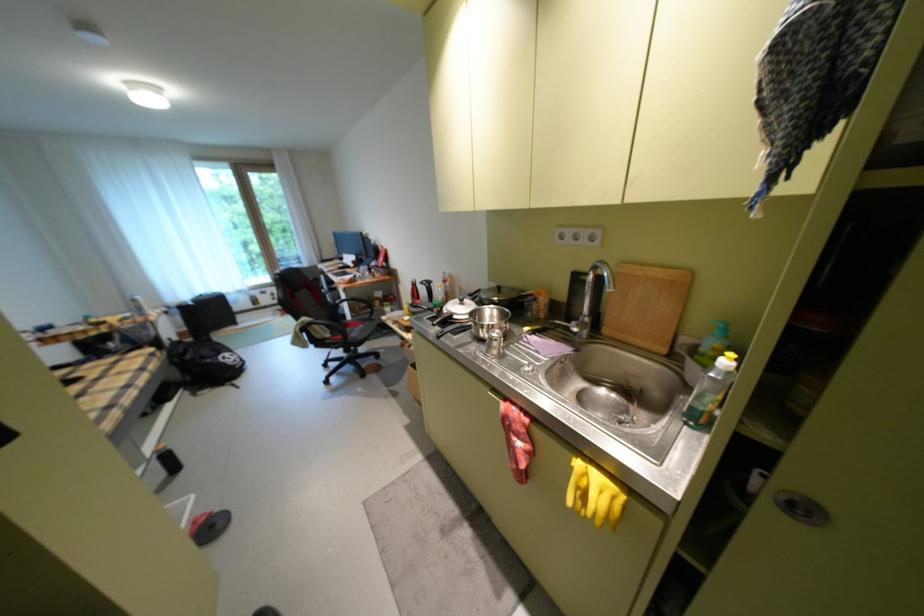
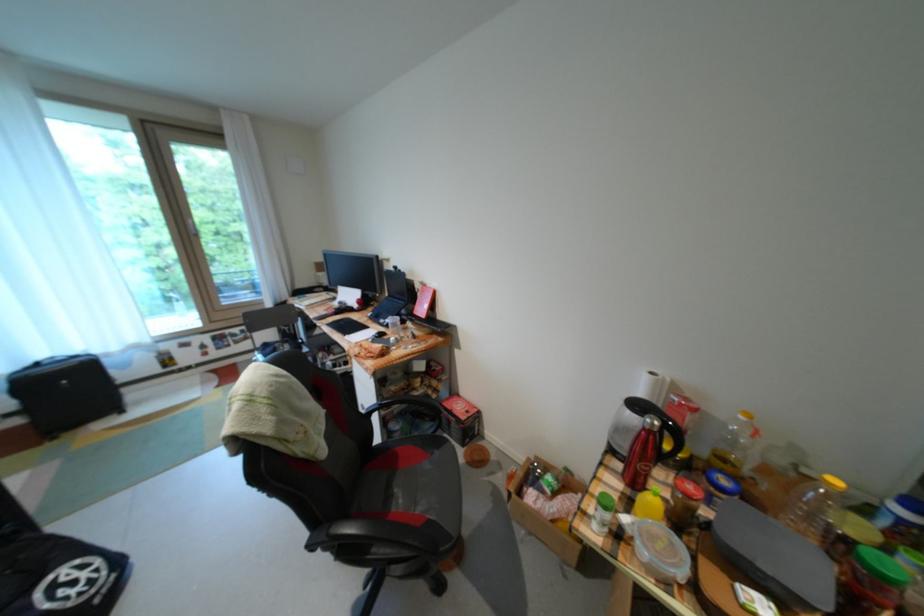
The point at (x=424, y=288) is marked in the first image. Where is the corresponding point in the second image?

(662, 438)